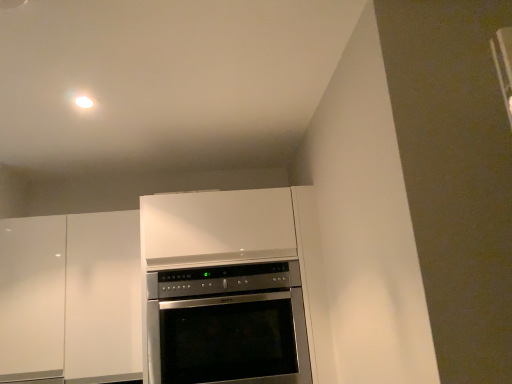
Question: From the image's perspective, is white glossy cabinet at left positioned above or below satin silver oven at center?

Choices:
 (A) below
 (B) above

Answer: (B)

Question: Is white glossy cabinet at left situated inside satin silver oven at center or outside?

Choices:
 (A) inside
 (B) outside

Answer: (B)

Question: Does point (41, 264) appear closer or farther from the camera than point (160, 292)?

Choices:
 (A) closer
 (B) farther

Answer: (B)

Question: From a real-world perspective, is satin silver oven at center positioned above or below white glossy cabinet at left?

Choices:
 (A) above
 (B) below

Answer: (B)

Question: Is satin silver oven at center inside or outside of white glossy cabinet at left?

Choices:
 (A) inside
 (B) outside

Answer: (B)

Question: Is point (286, 380) closer or farther from the camera than point (104, 221)?

Choices:
 (A) farther
 (B) closer

Answer: (B)

Question: From the image's perspective, relative to white glossy cabinet at left, is satin silver oven at center above or below?

Choices:
 (A) above
 (B) below

Answer: (B)